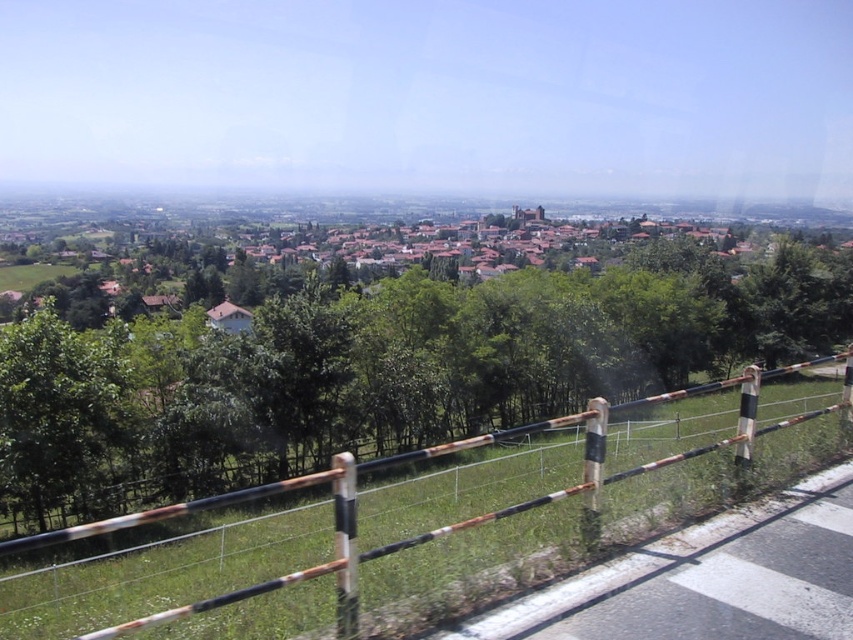
Describe the element at coordinates (428, 522) in the screenshot. I see `rusty metal fence at lower right` at that location.

Is rusty metal fence at lower right to the right of brown tiled roofs at center from the viewer's perspective?

Correct, you'll find rusty metal fence at lower right to the right of brown tiled roofs at center.

The width and height of the screenshot is (853, 640). What do you see at coordinates (428, 522) in the screenshot?
I see `rusty metal fence at lower right` at bounding box center [428, 522].

Find the location of a particular element. The width and height of the screenshot is (853, 640). rusty metal fence at lower right is located at coordinates (428, 522).

Does green leafy tree at center have a greater height compared to brown tiled roofs at center?

No, green leafy tree at center is not taller than brown tiled roofs at center.

Between green leafy tree at center and brown tiled roofs at center, which one appears on the left side from the viewer's perspective?

Positioned to the left is brown tiled roofs at center.

Which is behind, point (341, 369) or point (843, 314)?

The point (843, 314) is behind.

This screenshot has width=853, height=640. I want to click on green leafy tree at center, so click(380, 372).

Between green leafy tree at center and rusty metal fence at lower right, which one appears on the right side from the viewer's perspective?

green leafy tree at center

This screenshot has width=853, height=640. What do you see at coordinates (380, 372) in the screenshot?
I see `green leafy tree at center` at bounding box center [380, 372].

Who is more distant from viewer, (498, 394) or (384, 564)?

Point (498, 394)

This screenshot has height=640, width=853. In order to click on green leafy tree at center in this screenshot , I will do `click(380, 372)`.